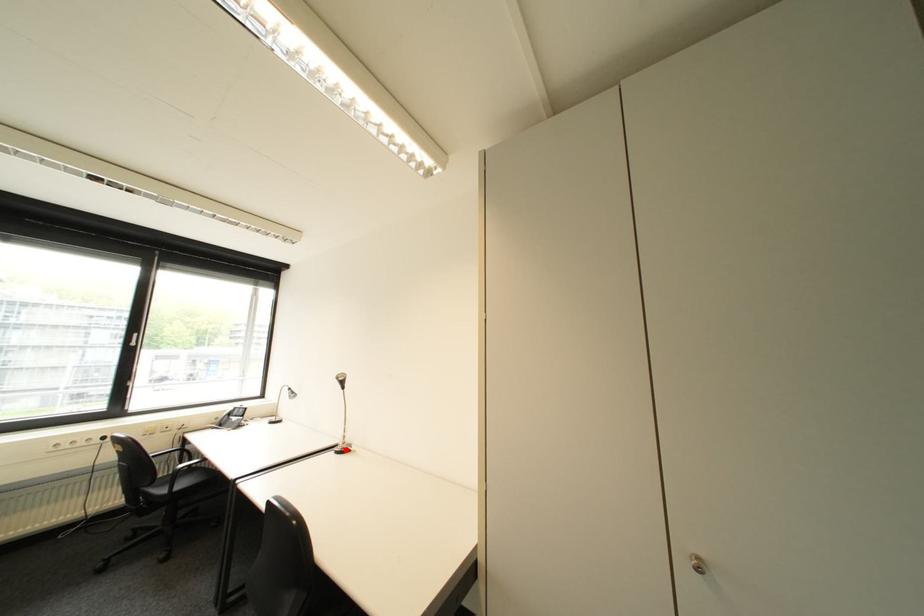
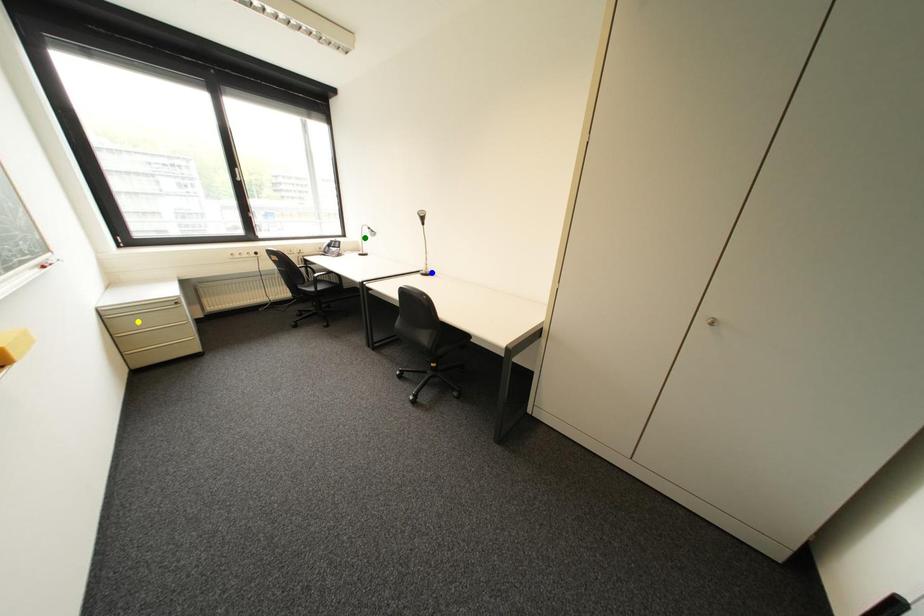
Question: I am providing you with two images of the same scene from different viewpoints. A red point is marked on the first image. You are given multiple points on the second image. Which point in image 2 represents the same 3d spot as the red point in image 1?

Choices:
 (A) blue point
 (B) yellow point
 (C) green point

Answer: (A)